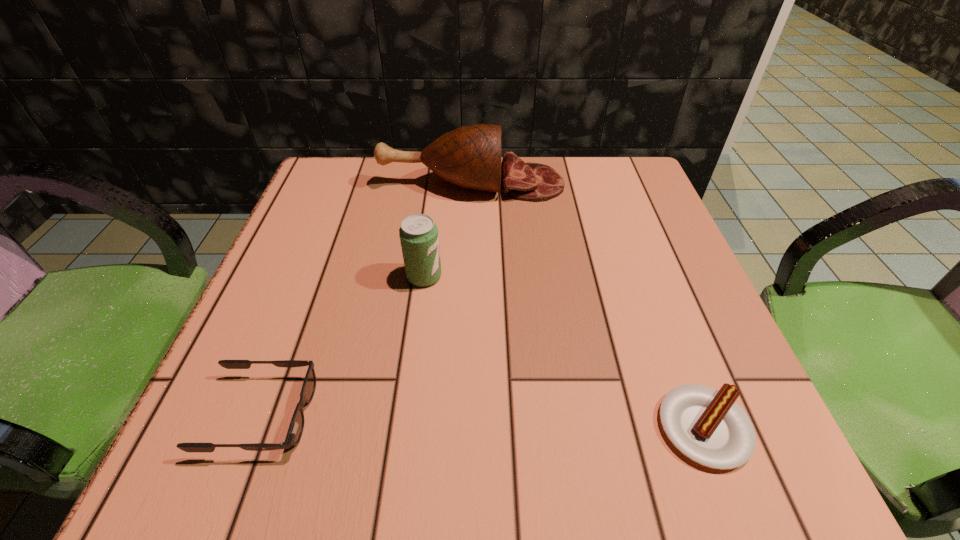
Image resolution: width=960 pixels, height=540 pixels. In the image, there is a desktop. Identify the location of free space at the near edge. (501, 439).

This screenshot has width=960, height=540. In the image, there is a desktop. In order to click on vacant space at the left edge in this screenshot , I will do `click(298, 275)`.

Identify the location of vacant space at the right edge of the desktop. (716, 329).

Where is `free region at the far left corner of the desktop`? Image resolution: width=960 pixels, height=540 pixels. free region at the far left corner of the desktop is located at coordinates tap(331, 156).

In the image, there is a desktop. Where is `free space at the near right corner`? The height and width of the screenshot is (540, 960). free space at the near right corner is located at coordinates (784, 471).

This screenshot has height=540, width=960. Identify the location of free space between the ham and the rightmost object. (588, 306).

Where is `vacant region between the leftmost object and the farthest object`? The height and width of the screenshot is (540, 960). vacant region between the leftmost object and the farthest object is located at coordinates [367, 299].

This screenshot has height=540, width=960. I want to click on empty space between the sausage and the farthest object, so click(588, 306).

The width and height of the screenshot is (960, 540). I want to click on free area in between the farthest object and the sausage, so click(x=588, y=306).

This screenshot has height=540, width=960. Find the location of `vacant region between the leftmost object and the sausage`. vacant region between the leftmost object and the sausage is located at coordinates (483, 421).